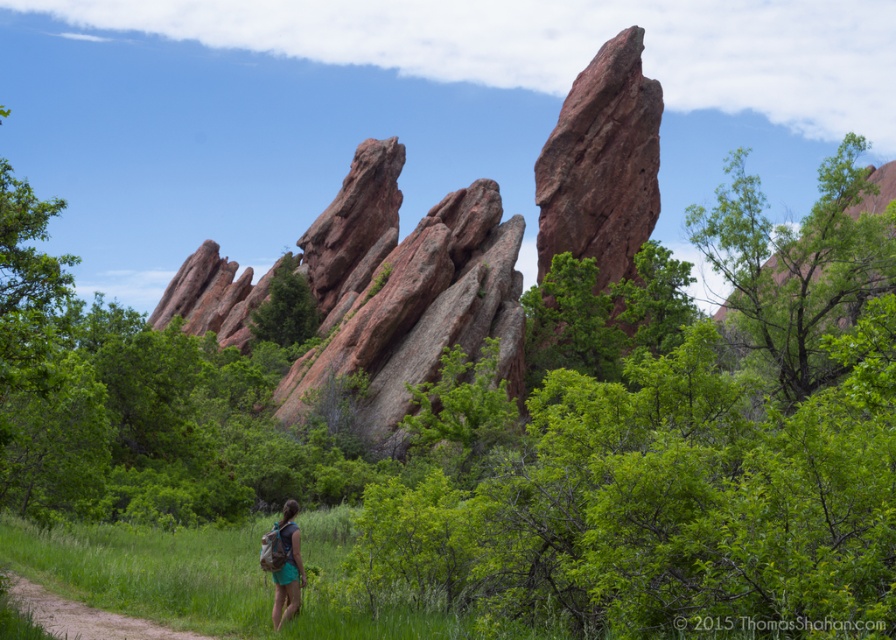
You are standing on the dirt path in the foreground of the red rock formations. You see two points marked in the scene. Which point, point (436, 368) or point (557, 122), is closer to you?

Point (436, 368) is closer to the viewer than point (557, 122).